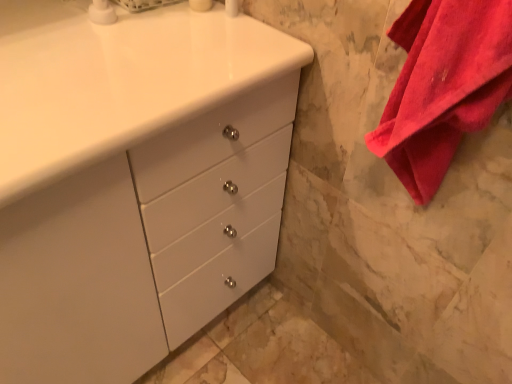
The width and height of the screenshot is (512, 384). In order to click on free space above white glossy cabinet at center (from a real-world perspective) in this screenshot , I will do `click(106, 47)`.